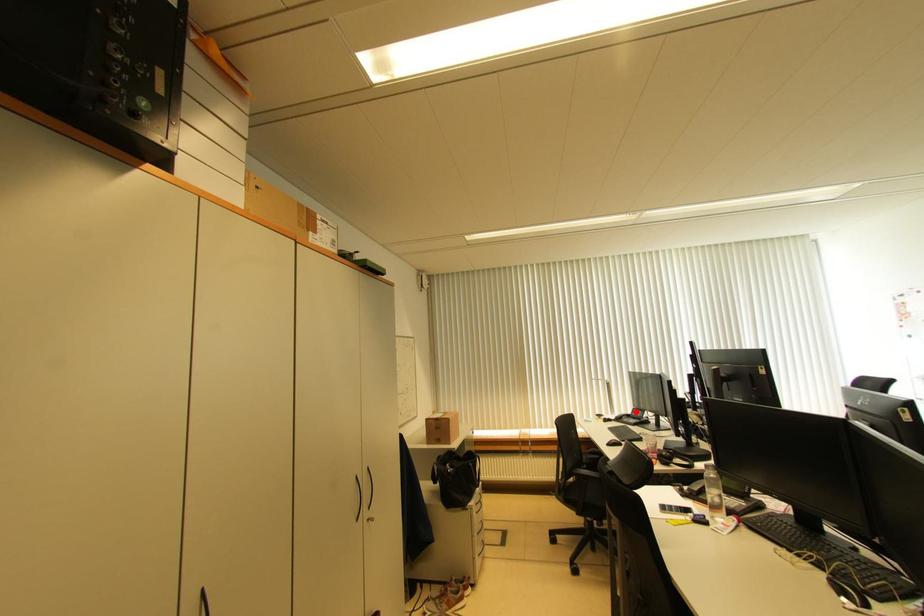
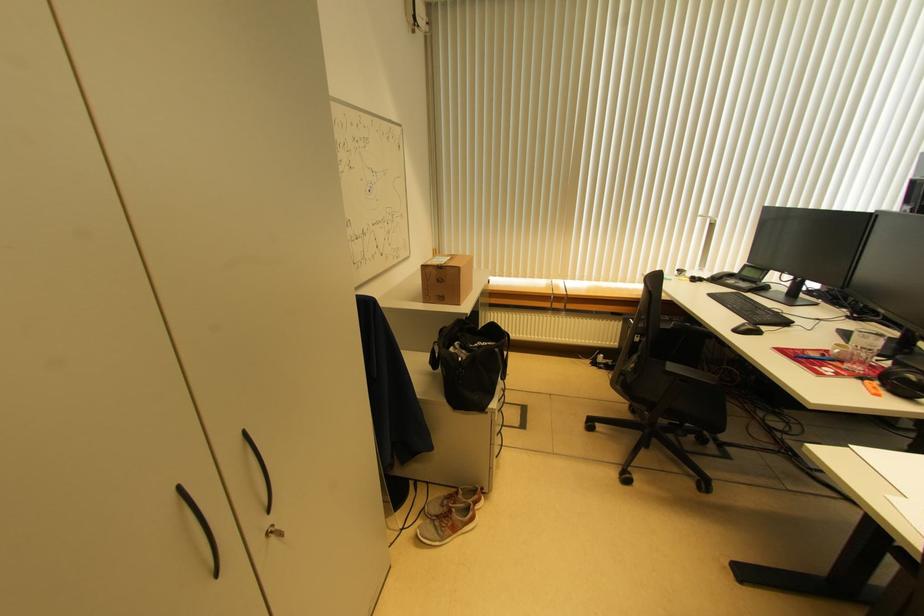
Question: I am providing you with two images of the same scene from different viewpoints. Image1 has a red point marked. In image2, the corresponding 3D location appears at what relative position? Reply with the corresponding letter.

Choices:
 (A) Closer
 (B) Farther

Answer: (A)